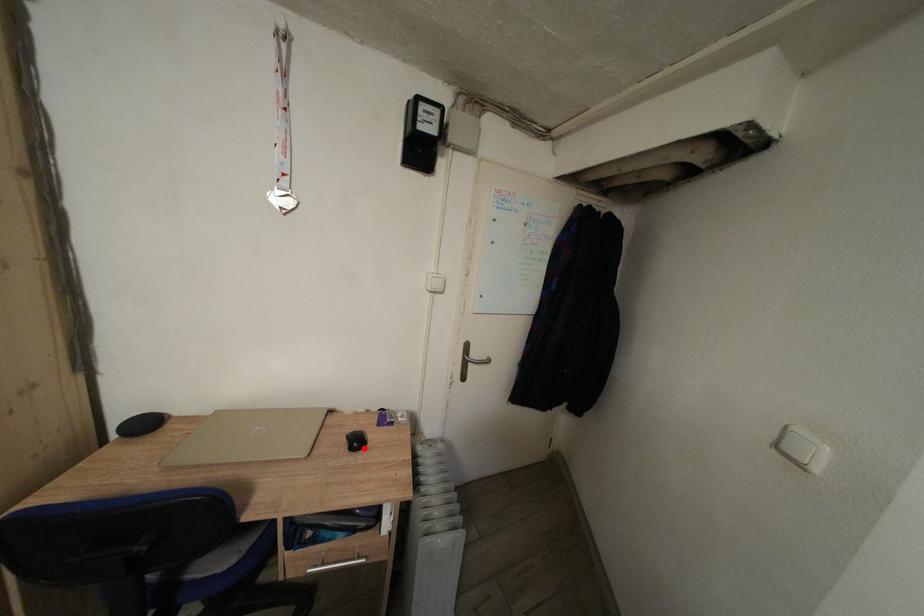
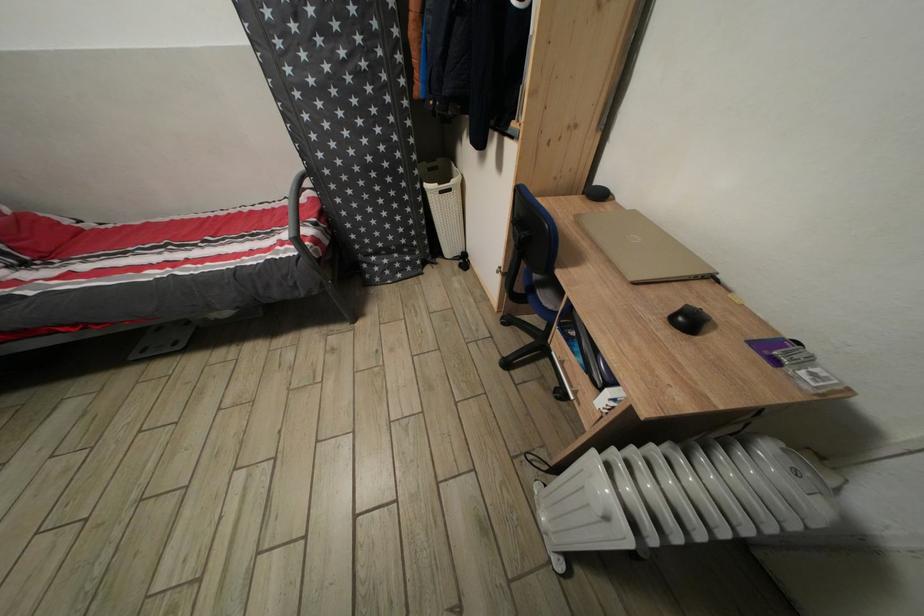
Question: I am providing you with two images of the same scene from different viewpoints. A red point is marked on the first image. At the location where the point appears in image 1, is it still visible in image 2?

Choices:
 (A) Yes
 (B) No

Answer: (A)